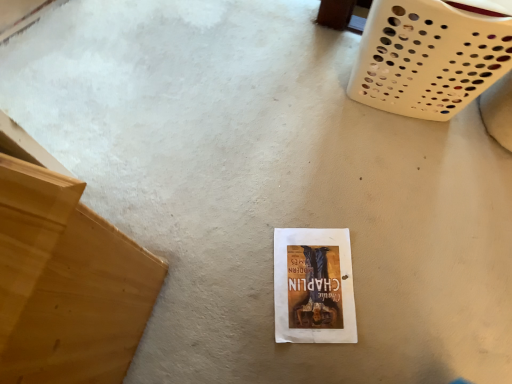
The image size is (512, 384). What are the coordinates of `vacant area on the back side of white paper at center` in the screenshot? It's located at (310, 192).